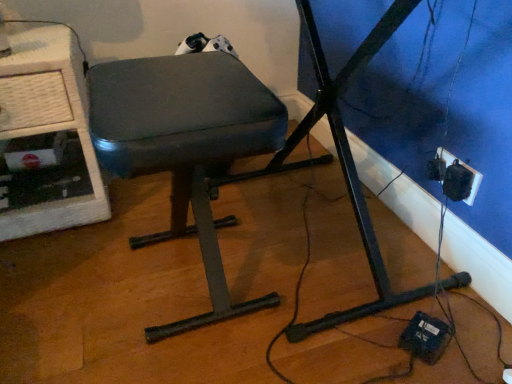
Question: Is white textured computer desk at left at the back of black plastic socket at lower right?

Choices:
 (A) yes
 (B) no

Answer: (B)

Question: Considering the relative sizes of black plastic socket at lower right and white textured computer desk at left in the image provided, is black plastic socket at lower right shorter than white textured computer desk at left?

Choices:
 (A) yes
 (B) no

Answer: (A)

Question: Is white textured computer desk at left a part of black plastic socket at lower right?

Choices:
 (A) no
 (B) yes

Answer: (A)

Question: Is black plastic socket at lower right not close to white textured computer desk at left?

Choices:
 (A) yes
 (B) no

Answer: (A)

Question: Is black plastic socket at lower right closer to camera compared to white textured computer desk at left?

Choices:
 (A) yes
 (B) no

Answer: (B)

Question: Does black plastic socket at lower right have a greater width compared to white textured computer desk at left?

Choices:
 (A) yes
 (B) no

Answer: (B)

Question: Is matte black stool at center smaller than black plastic socket at lower right?

Choices:
 (A) no
 (B) yes

Answer: (A)

Question: Is matte black stool at center outside black plastic socket at lower right?

Choices:
 (A) no
 (B) yes

Answer: (B)

Question: Does matte black stool at center have a larger size compared to black plastic socket at lower right?

Choices:
 (A) no
 (B) yes

Answer: (B)

Question: From the image's perspective, is matte black stool at center on top of black plastic socket at lower right?

Choices:
 (A) yes
 (B) no

Answer: (B)

Question: From a real-world perspective, is matte black stool at center beneath black plastic socket at lower right?

Choices:
 (A) no
 (B) yes

Answer: (A)

Question: Does matte black stool at center come behind black plastic socket at lower right?

Choices:
 (A) no
 (B) yes

Answer: (A)

Question: Does black plastic socket at lower right have a lesser width compared to matte black stool at center?

Choices:
 (A) yes
 (B) no

Answer: (A)